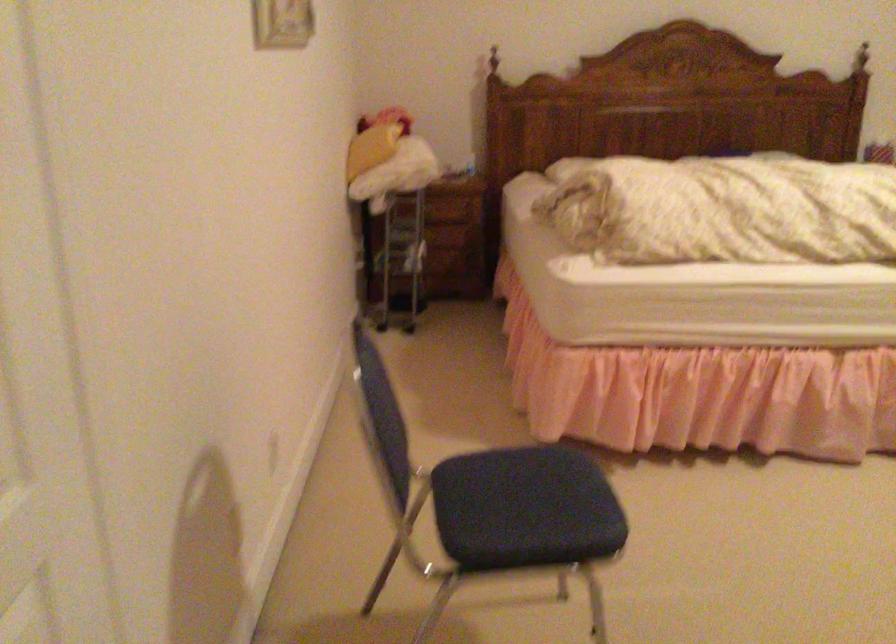
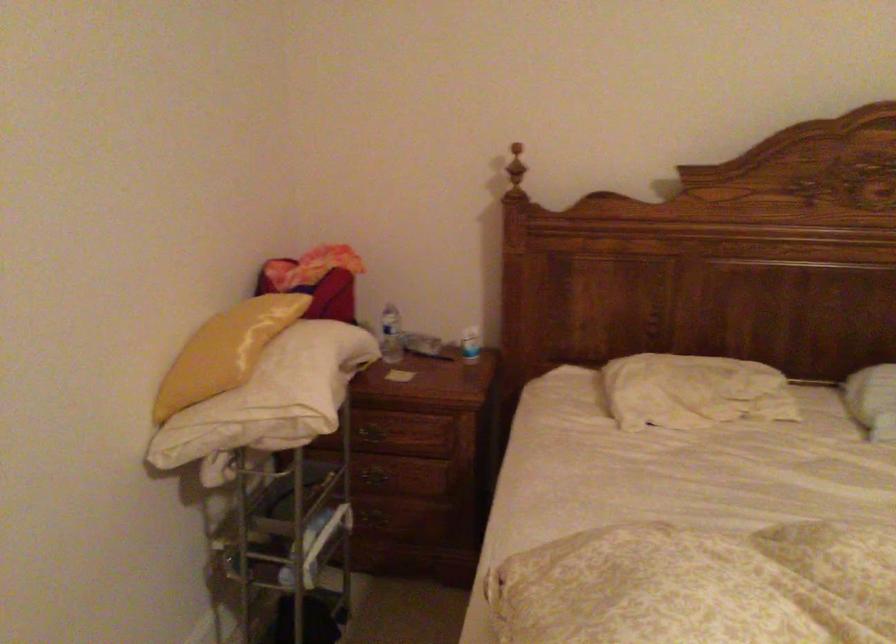
Where in the second image is the point corresponding to point (408, 145) from the first image?

(287, 375)